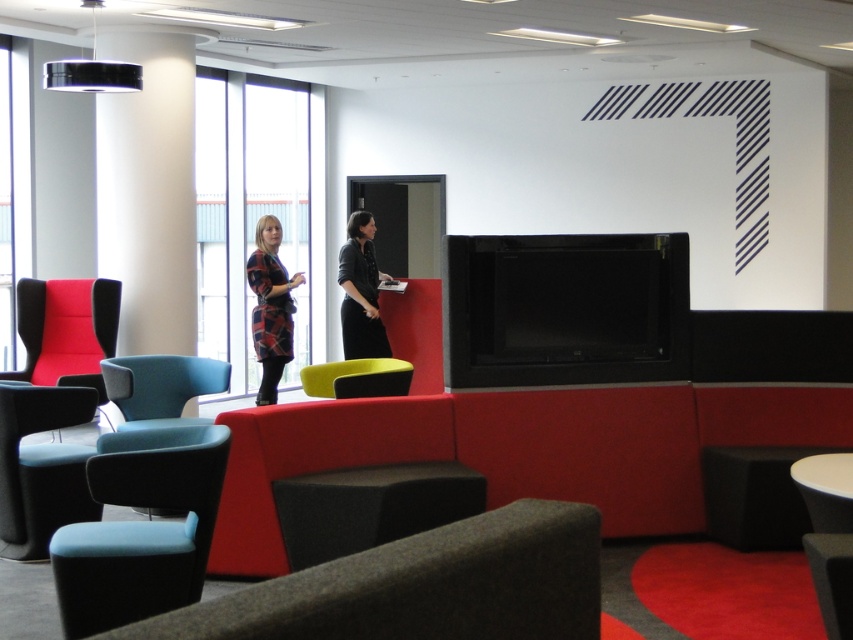
Question: Is teal fabric chair at center smaller than yellow fabric chair at center?

Choices:
 (A) no
 (B) yes

Answer: (A)

Question: Which is farther from the dark gray fabric armchair at lower center?

Choices:
 (A) white glossy table at lower right
 (B) teal fabric chair at left

Answer: (B)

Question: Which point is closer to the camera taking this photo?

Choices:
 (A) (844, 486)
 (B) (256, 394)

Answer: (A)

Question: Which is nearer to the black leather jacket at center?

Choices:
 (A) matte blue armchair at lower left
 (B) plaid fabric shirt at center
 (C) teal fabric chair at left
 (D) white glossy table at lower right

Answer: (B)

Question: Can you confirm if dark gray fabric armchair at lower center is thinner than black leather jacket at center?

Choices:
 (A) no
 (B) yes

Answer: (A)

Question: Is red fabric wingback chair at left further to camera compared to yellow fabric chair at center?

Choices:
 (A) no
 (B) yes

Answer: (B)